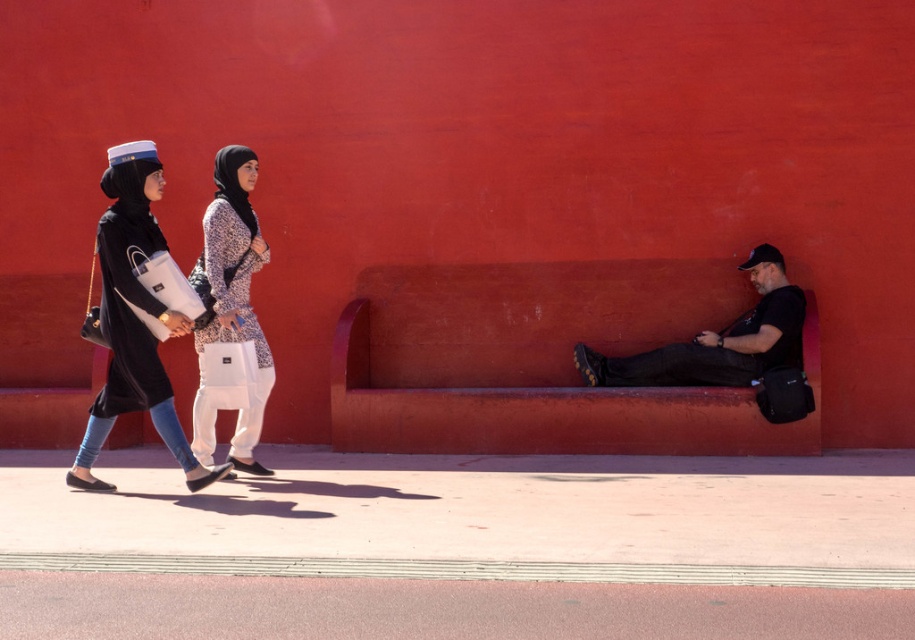
Question: Which point is closer to the camera?

Choices:
 (A) black matte shirt at center
 (B) matte black dress at left
 (C) patterned fabric hijab at center
 (D) pink rubber pavement at lower center

Answer: (D)

Question: Which point is farther from the camera taking this photo?

Choices:
 (A) (207, 592)
 (B) (211, 221)

Answer: (B)

Question: Is matte black dress at left closer to camera compared to black matte shirt at center?

Choices:
 (A) yes
 (B) no

Answer: (A)

Question: Which is nearer to the matte black dress at left?

Choices:
 (A) pink rubber pavement at lower center
 (B) black matte shirt at center
 (C) patterned fabric hijab at center

Answer: (C)

Question: Can you confirm if patterned fabric hijab at center is positioned to the left of black matte shirt at center?

Choices:
 (A) yes
 (B) no

Answer: (A)

Question: Can you confirm if pink rubber pavement at lower center is smaller than matte black dress at left?

Choices:
 (A) yes
 (B) no

Answer: (A)